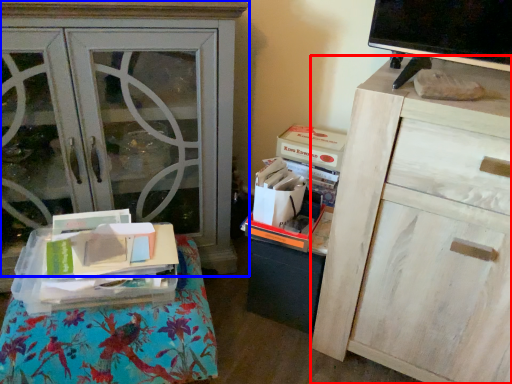
Question: Which object is further to the camera taking this photo, chest of drawers (highlighted by a red box) or cabinetry (highlighted by a blue box)?

Choices:
 (A) chest of drawers
 (B) cabinetry

Answer: (B)